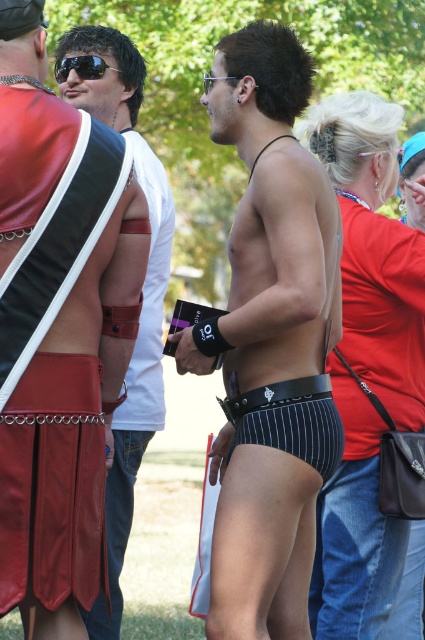
You are a photographer trying to capture a closeup shot of the black mesh bikini top at center and the matte black shorts at center. Which one of these items will appear wider in your photo?

The black mesh bikini top at center is narrower than the matte black shorts at center, so the shorts will appear wider in the photo.

You are standing at the point marked by the coordinates point (401, 369). A friend is located exactly where you are. You both decide to walk towards the viewer simultaneously. Who will reach the viewer first?

Both you and your friend are at the same starting point, point (401, 369), so you will both reach the viewer at the same time since you are moving towards the viewer from the same location.